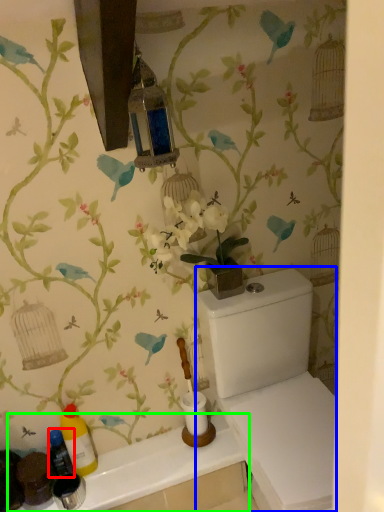
Question: Considering the real-world distances, which object is farthest from bottle (highlighted by a red box)? porcelain (highlighted by a blue box) or counter top (highlighted by a green box)?

Choices:
 (A) porcelain
 (B) counter top

Answer: (A)